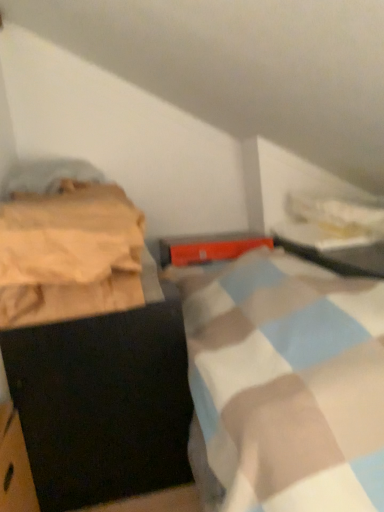
The height and width of the screenshot is (512, 384). What do you see at coordinates (90, 350) in the screenshot? I see `black matte cabinet at left` at bounding box center [90, 350].

Measure the distance between beige cotton blanket at left and camera.

beige cotton blanket at left is 95.63 centimeters away from camera.

What do you see at coordinates (332, 250) in the screenshot? I see `metallic silver table at upper right` at bounding box center [332, 250].

Image resolution: width=384 pixels, height=512 pixels. I want to click on black matte cabinet at left, so click(x=90, y=350).

Consider the image. Considering the sizes of metallic silver table at upper right and black matte cabinet at left in the image, is metallic silver table at upper right wider or thinner than black matte cabinet at left?

In the image, metallic silver table at upper right appears to be more narrow than black matte cabinet at left.

Is point (380, 245) farther from camera compared to point (87, 295)?

Yes, it is behind point (87, 295).

Is the surface of metallic silver table at upper right in direct contact with black matte cabinet at left?

metallic silver table at upper right and black matte cabinet at left are not in contact.

From the image's perspective, between metallic silver table at upper right and black matte cabinet at left, who is located below?

black matte cabinet at left is shown below in the image.

Where is `table located on the right of beige cotton blanket at left`? The width and height of the screenshot is (384, 512). table located on the right of beige cotton blanket at left is located at coordinates (332, 250).

Does metallic silver table at upper right have a greater height compared to beige cotton blanket at left?

Incorrect, the height of metallic silver table at upper right is not larger of that of beige cotton blanket at left.

Can you confirm if metallic silver table at upper right is wider than beige cotton blanket at left?

No, metallic silver table at upper right is not wider than beige cotton blanket at left.

Which of these two, metallic silver table at upper right or beige cotton blanket at left, is bigger?

metallic silver table at upper right is bigger.

Is black matte cabinet at left surrounding metallic silver table at upper right?

Actually, metallic silver table at upper right is outside black matte cabinet at left.

Who is bigger, black matte cabinet at left or metallic silver table at upper right?

Bigger between the two is black matte cabinet at left.

From the image's perspective, between black matte cabinet at left and metallic silver table at upper right, who is located below?

From the image's view, black matte cabinet at left is below.

From a real-world perspective, is black matte cabinet at left under metallic silver table at upper right?

Yes, from a real-world perspective, black matte cabinet at left is under metallic silver table at upper right.

From the image's perspective, is black matte cabinet at left positioned above or below beige cotton blanket at left?

From the image's perspective, black matte cabinet at left appears below beige cotton blanket at left.

Is black matte cabinet at left to the left of beige cotton blanket at left from the viewer's perspective?

No.

From their relative heights in the image, would you say black matte cabinet at left is taller or shorter than beige cotton blanket at left?

Considering their sizes, black matte cabinet at left has more height than beige cotton blanket at left.

Locate an element on the screen. furniture that appears below the beige cotton blanket at left (from a real-world perspective) is located at coordinates point(90,350).

Where is `blanket above the metallic silver table at upper right (from a real-world perspective)`? blanket above the metallic silver table at upper right (from a real-world perspective) is located at coordinates (69, 254).

Considering their positions, is beige cotton blanket at left located in front of or behind metallic silver table at upper right?

In the image, beige cotton blanket at left appears in front of metallic silver table at upper right.

Is beige cotton blanket at left turned away from metallic silver table at upper right?

No, beige cotton blanket at left is not facing away from metallic silver table at upper right.

Considering the relative positions of beige cotton blanket at left and metallic silver table at upper right in the image provided, is beige cotton blanket at left to the left or to the right of metallic silver table at upper right?

beige cotton blanket at left is positioned on metallic silver table at upper right's left side.

Are beige cotton blanket at left and black matte cabinet at left located far from each other?

beige cotton blanket at left is actually quite close to black matte cabinet at left.

Considering the relative positions of beige cotton blanket at left and black matte cabinet at left in the image provided, is beige cotton blanket at left to the right of black matte cabinet at left from the viewer's perspective?

No.

Can you confirm if beige cotton blanket at left is wider than black matte cabinet at left?

No.

Does beige cotton blanket at left contain black matte cabinet at left?

Actually, black matte cabinet at left is outside beige cotton blanket at left.

At what (x,y) coordinates should I click in order to perform the action: click on table that appears on the right of black matte cabinet at left. Please return your answer as a coordinate pair (x, y). Looking at the image, I should click on (332, 250).

Identify the location of table located behind the beige cotton blanket at left. This screenshot has height=512, width=384. (332, 250).

Estimate the real-world distances between objects in this image. Which object is further from beige cotton blanket at left, black matte cabinet at left or metallic silver table at upper right?

Based on the image, metallic silver table at upper right appears to be further to beige cotton blanket at left.

Looking at the image, which one is located closer to metallic silver table at upper right, black matte cabinet at left or beige cotton blanket at left?

Based on the image, black matte cabinet at left appears to be nearer to metallic silver table at upper right.

Estimate the real-world distances between objects in this image. Which object is further from black matte cabinet at left, beige cotton blanket at left or metallic silver table at upper right?

metallic silver table at upper right.

When comparing their distances from beige cotton blanket at left, does metallic silver table at upper right or black matte cabinet at left seem further?

The object further to beige cotton blanket at left is metallic silver table at upper right.

Which object lies nearer to the anchor point metallic silver table at upper right, beige cotton blanket at left or black matte cabinet at left?

black matte cabinet at left lies closer to metallic silver table at upper right than the other object.

Looking at the image, which one is located further to black matte cabinet at left, metallic silver table at upper right or beige cotton blanket at left?

metallic silver table at upper right lies further to black matte cabinet at left than the other object.

This screenshot has height=512, width=384. Identify the location of furniture situated between beige cotton blanket at left and metallic silver table at upper right from left to right. (90, 350).